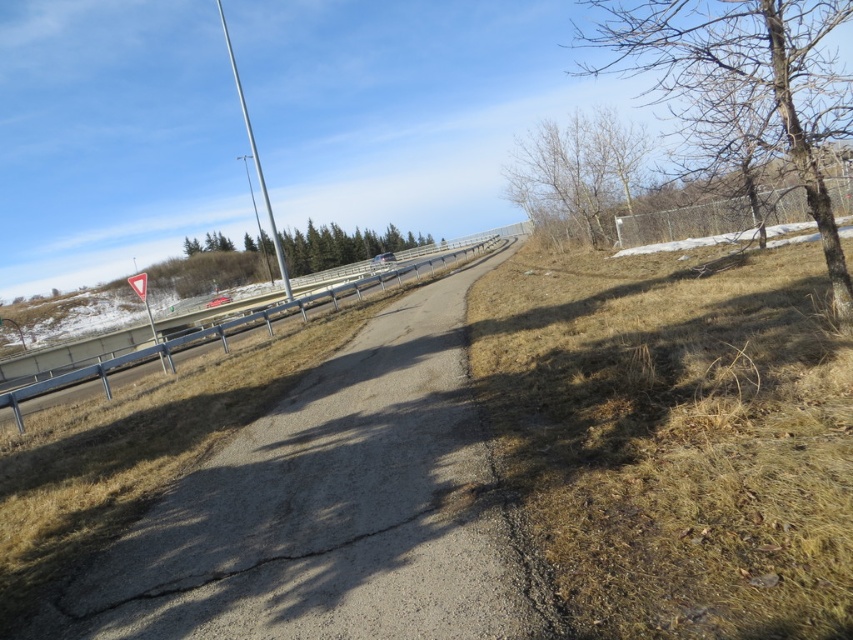
You are a delivery driver who needs to cross the road safely. You see the bare branches at upper right and the metallic gray train track at left. Which object is closer to your current position if you are standing exactly in the middle of the road?

The metallic gray train track at left is closer to your current position because it is only 38.11 feet away from the bare branches at upper right, so if you are in the middle, the train track would be nearer than the branches.

You are a pedestrian walking along the road and see the bare branches at upper right and the metallic gray train track at left. Which object is located above the other?

The bare branches at upper right is positioned over the metallic gray train track at left, so it is above the train track.

You are a surveyor measuring distances between landmarks. You have to report the length of the gray asphalt highway at center and the metallic gray train track at left. Which one is shorter?

The gray asphalt highway at center is shorter than the metallic gray train track at left.